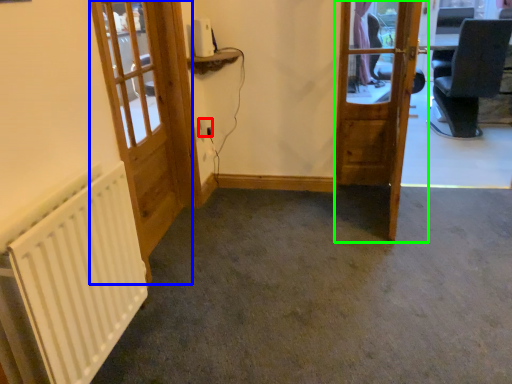
Question: Estimate the real-world distances between objects in this image. Which object is closer to electric outlet (highlighted by a red box), door (highlighted by a blue box) or door (highlighted by a green box)?

Choices:
 (A) door
 (B) door

Answer: (A)